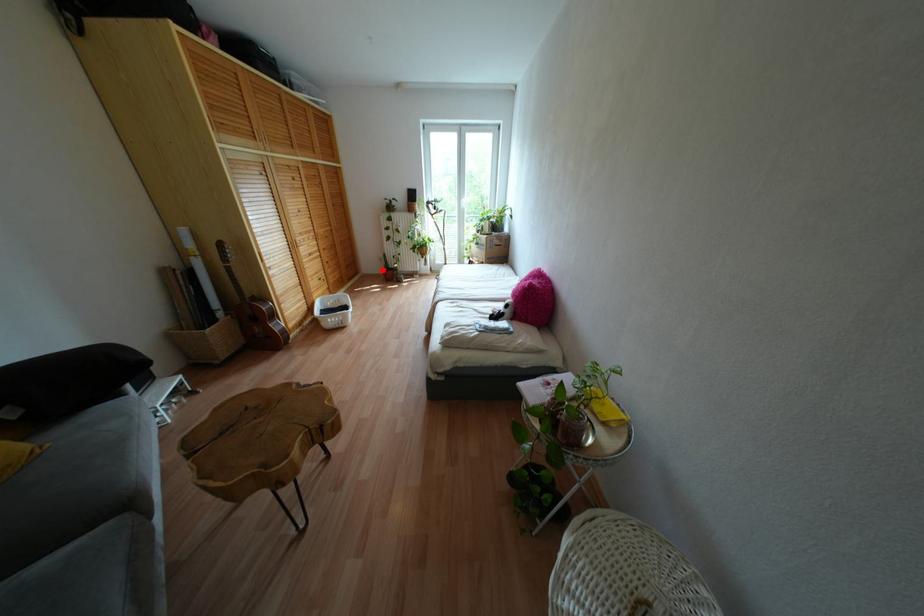
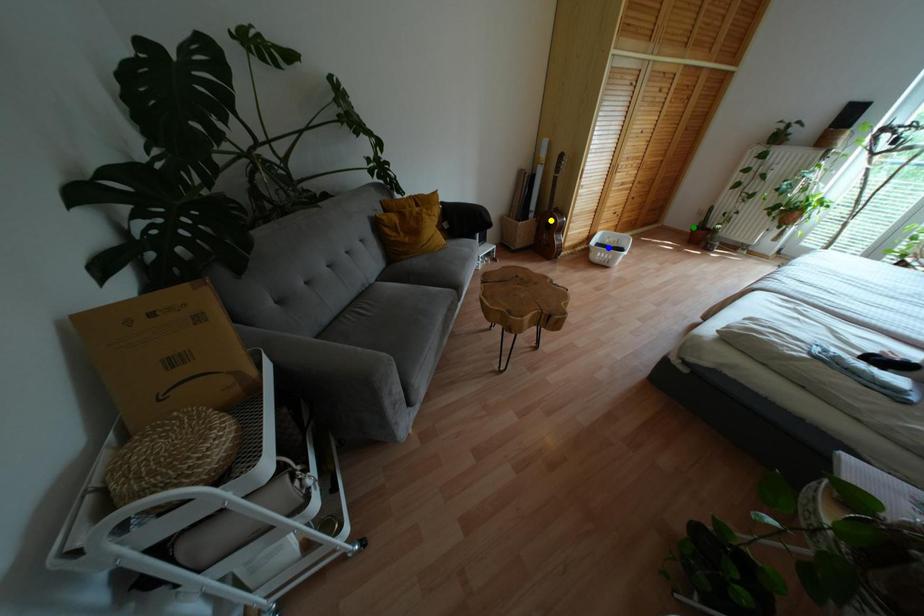
Question: I am providing you with two images of the same scene from different viewpoints. A red point is marked on the first image. You are given multiple points on the second image. Which point in image 2 represents the same 3d spot as the red point in image 1?

Choices:
 (A) yellow point
 (B) green point
 (C) blue point

Answer: (B)